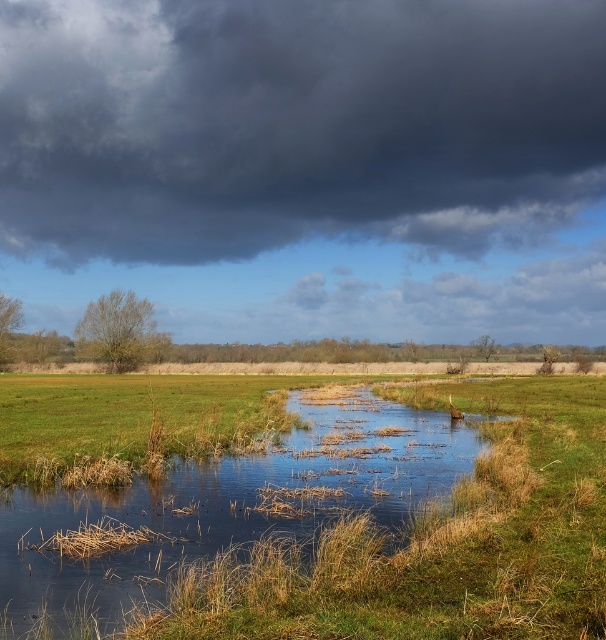
Question: Can you confirm if dark gray cloud at upper center is positioned to the left of green grassy stream at center?

Choices:
 (A) no
 (B) yes

Answer: (A)

Question: Which point is farther to the camera?

Choices:
 (A) dark gray cloud at upper center
 (B) green grassy stream at center

Answer: (A)

Question: Which object is closer to the camera taking this photo?

Choices:
 (A) green grassy stream at center
 (B) dark gray cloud at upper center

Answer: (A)

Question: Which point appears farthest from the camera in this image?

Choices:
 (A) (458, 467)
 (B) (514, 52)

Answer: (B)

Question: Can you confirm if dark gray cloud at upper center is positioned above green grassy stream at center?

Choices:
 (A) yes
 (B) no

Answer: (A)

Question: Considering the relative positions of dark gray cloud at upper center and green grassy stream at center in the image provided, where is dark gray cloud at upper center located with respect to green grassy stream at center?

Choices:
 (A) left
 (B) right

Answer: (B)